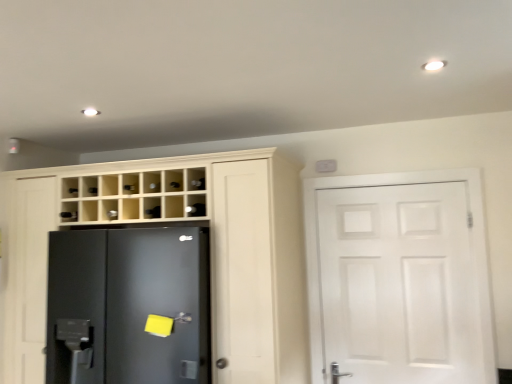
Image resolution: width=512 pixels, height=384 pixels. What are the coordinates of `free spot above white matte door at right (from a real-world perspective)` in the screenshot? It's located at (387, 190).